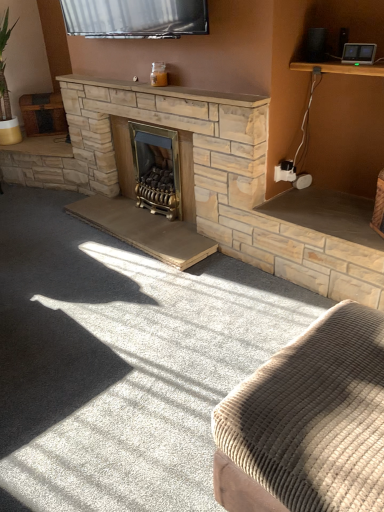
Question: Does gold metallic wood burning stove at center have a lesser width compared to corduroy fabric ottoman at lower right?

Choices:
 (A) yes
 (B) no

Answer: (A)

Question: From the image's perspective, is gold metallic wood burning stove at center over corduroy fabric ottoman at lower right?

Choices:
 (A) yes
 (B) no

Answer: (A)

Question: Considering the relative sizes of gold metallic wood burning stove at center and corduroy fabric ottoman at lower right in the image provided, is gold metallic wood burning stove at center shorter than corduroy fabric ottoman at lower right?

Choices:
 (A) yes
 (B) no

Answer: (B)

Question: Is gold metallic wood burning stove at center smaller than corduroy fabric ottoman at lower right?

Choices:
 (A) yes
 (B) no

Answer: (A)

Question: Would you say gold metallic wood burning stove at center contains corduroy fabric ottoman at lower right?

Choices:
 (A) no
 (B) yes

Answer: (A)

Question: Is gold metallic wood burning stove at center located outside corduroy fabric ottoman at lower right?

Choices:
 (A) yes
 (B) no

Answer: (A)

Question: Is smooth stone mantle at upper center to the right of corduroy fabric ottoman at lower right from the viewer's perspective?

Choices:
 (A) yes
 (B) no

Answer: (B)

Question: Is smooth stone mantle at upper center aimed at corduroy fabric ottoman at lower right?

Choices:
 (A) no
 (B) yes

Answer: (A)

Question: Is smooth stone mantle at upper center turned away from corduroy fabric ottoman at lower right?

Choices:
 (A) yes
 (B) no

Answer: (B)

Question: From a real-world perspective, is smooth stone mantle at upper center physically above corduroy fabric ottoman at lower right?

Choices:
 (A) no
 (B) yes

Answer: (B)

Question: Is smooth stone mantle at upper center further to the viewer compared to corduroy fabric ottoman at lower right?

Choices:
 (A) no
 (B) yes

Answer: (B)

Question: From the image's perspective, is smooth stone mantle at upper center on top of corduroy fabric ottoman at lower right?

Choices:
 (A) yes
 (B) no

Answer: (A)

Question: Would you say corduroy fabric ottoman at lower right contains gold metallic wood burning stove at center?

Choices:
 (A) yes
 (B) no

Answer: (B)